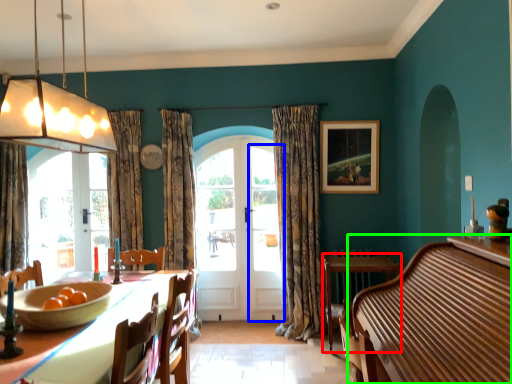
Question: Based on their relative distances, which object is nearer to round table (highlighted by a red box)? Choose from screen door (highlighted by a blue box) and dresser (highlighted by a green box).

Choices:
 (A) screen door
 (B) dresser

Answer: (A)